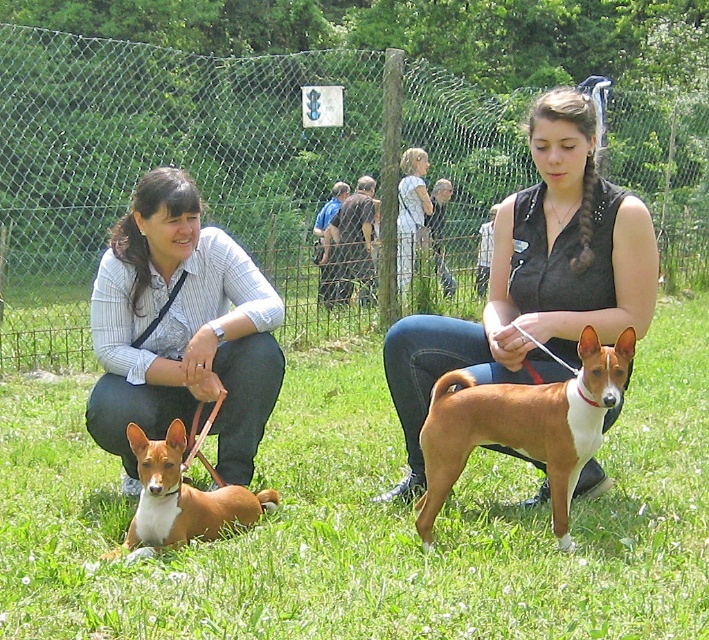
Question: Which of these objects is positioned closest to the brown smooth dog at lower left?

Choices:
 (A) brown smooth coat dog at center
 (B) black sleeveless top at center

Answer: (B)

Question: Can you confirm if green grass at lower center is smaller than brown smooth coat dog at center?

Choices:
 (A) no
 (B) yes

Answer: (B)

Question: Which point appears closest to the camera in this image?

Choices:
 (A) (x=411, y=424)
 (B) (x=140, y=472)

Answer: (B)

Question: Can you confirm if green grass at lower center is positioned above black sleeveless top at center?

Choices:
 (A) yes
 (B) no

Answer: (B)

Question: Estimate the real-world distances between objects in this image. Which object is farther from the matte black shirt at left?

Choices:
 (A) brown smooth coat dog at center
 (B) brown smooth dog at lower left

Answer: (A)

Question: Is the position of black sleeveless top at center more distant than that of matte black shirt at left?

Choices:
 (A) yes
 (B) no

Answer: (B)